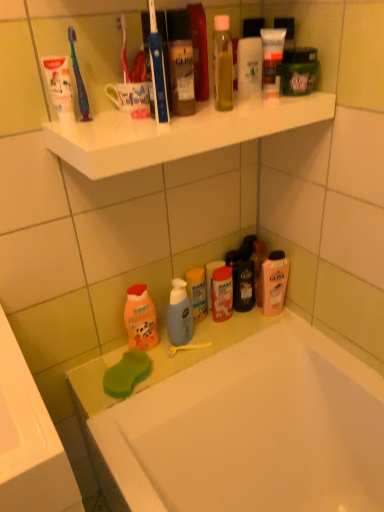
Locate an element on the screen. The width and height of the screenshot is (384, 512). vacant region in front of shiny plastic bottle at upper center, the first toiletry positioned from the front is located at coordinates (158, 130).